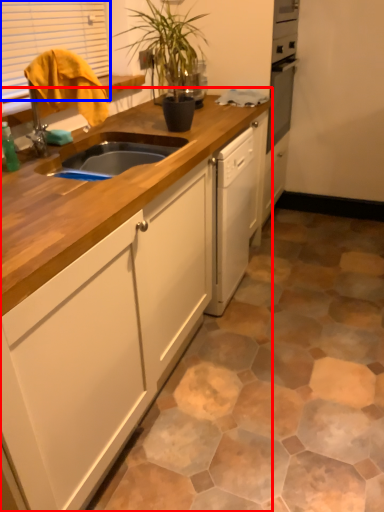
Question: Among these objects, which one is nearest to the camera, cabinetry (highlighted by a red box) or window (highlighted by a blue box)?

Choices:
 (A) cabinetry
 (B) window

Answer: (A)